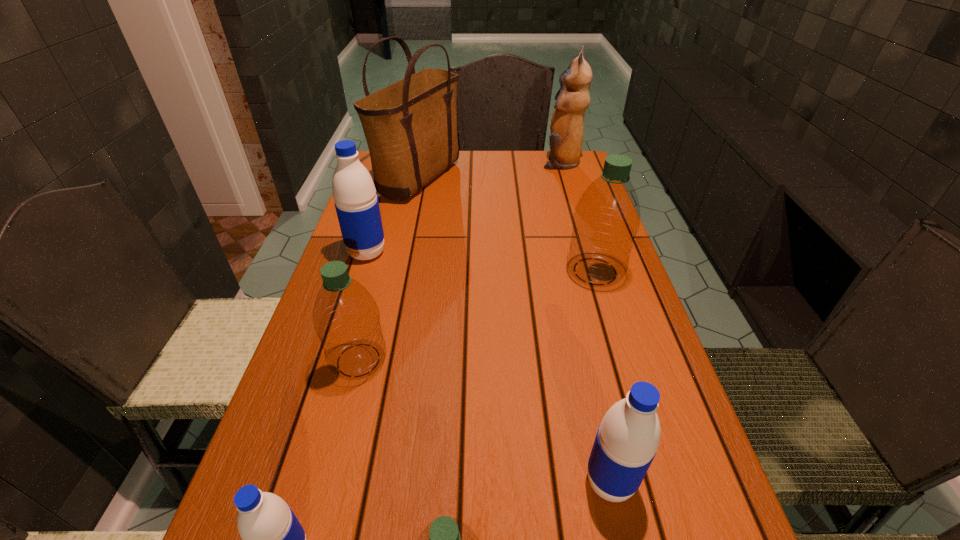
The height and width of the screenshot is (540, 960). What are the coordinates of `tote bag` in the screenshot? It's located at (410, 126).

Image resolution: width=960 pixels, height=540 pixels. I want to click on cat, so click(x=567, y=123).

Image resolution: width=960 pixels, height=540 pixels. I want to click on the biggest blue water bottle, so click(356, 203).

Identify the location of the rightmost green water bottle. (606, 219).

Find the location of a particular element. The height and width of the screenshot is (540, 960). the farthest green water bottle is located at coordinates (606, 219).

You are a GUI agent. You are given a task and a screenshot of the screen. Output one action in this format:
    pyautogui.click(x=<x>, y=<y>)
    Task: Click on the fourth nearest object
    The height and width of the screenshot is (540, 960).
    Given the screenshot: What is the action you would take?
    pyautogui.click(x=346, y=318)

Find the location of a particular element. This screenshot has width=960, height=540. the second nearest green water bottle is located at coordinates (346, 318).

The width and height of the screenshot is (960, 540). Identify the location of the rightmost blue water bottle. (626, 442).

At what (x,y) coordinates should I click in order to perform the action: click on the fourth farthest water bottle. Please return your answer as a coordinate pair (x, y). The width and height of the screenshot is (960, 540). Looking at the image, I should click on coord(626,442).

Find the location of a particular element. The height and width of the screenshot is (540, 960). free region located on the front of the tote bag is located at coordinates (407, 236).